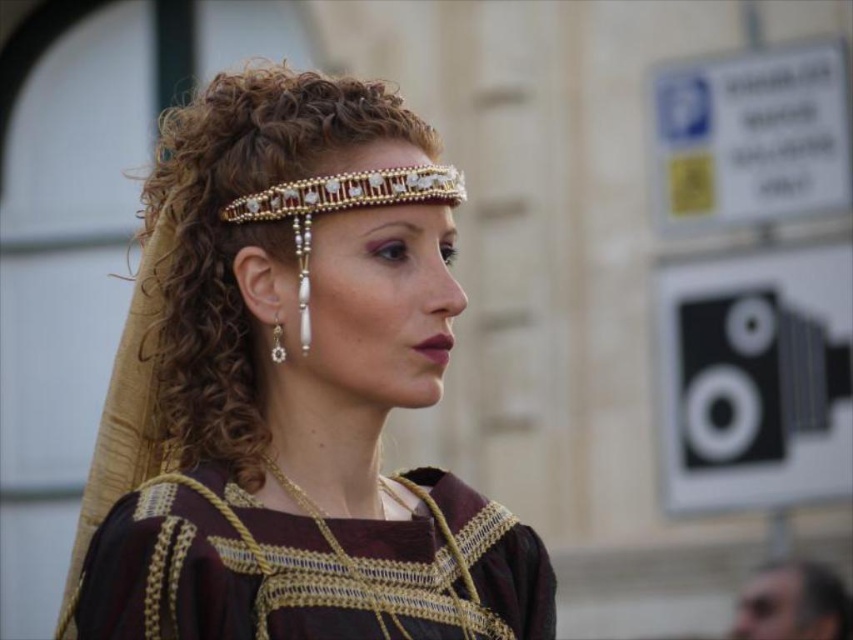
Can you confirm if matte gold headband at center is shorter than pearl/stone earrings at left?

Incorrect, matte gold headband at center's height does not fall short of pearl/stone earrings at left's.

Describe the element at coordinates (291, 390) in the screenshot. The width and height of the screenshot is (853, 640). I see `matte gold headband at center` at that location.

Identify the location of matte gold headband at center. (291, 390).

Is point (78, 580) positioned before point (444, 188)?

No, (78, 580) is further to viewer.

In the scene shown: Who is positioned more to the right, burgundy fabric dress at center or gold beaded tiara at upper center?

burgundy fabric dress at center is more to the right.

Who is more forward, (152, 524) or (430, 179)?

Point (152, 524) is more forward.

The image size is (853, 640). I want to click on burgundy fabric dress at center, so click(310, 566).

Is gold beaded tiara at upper center bigger than pearl/stone earrings at left?

Actually, gold beaded tiara at upper center might be smaller than pearl/stone earrings at left.

Is point (344, 176) closer to viewer compared to point (277, 356)?

Yes.

Locate an element on the screen. gold beaded tiara at upper center is located at coordinates (347, 193).